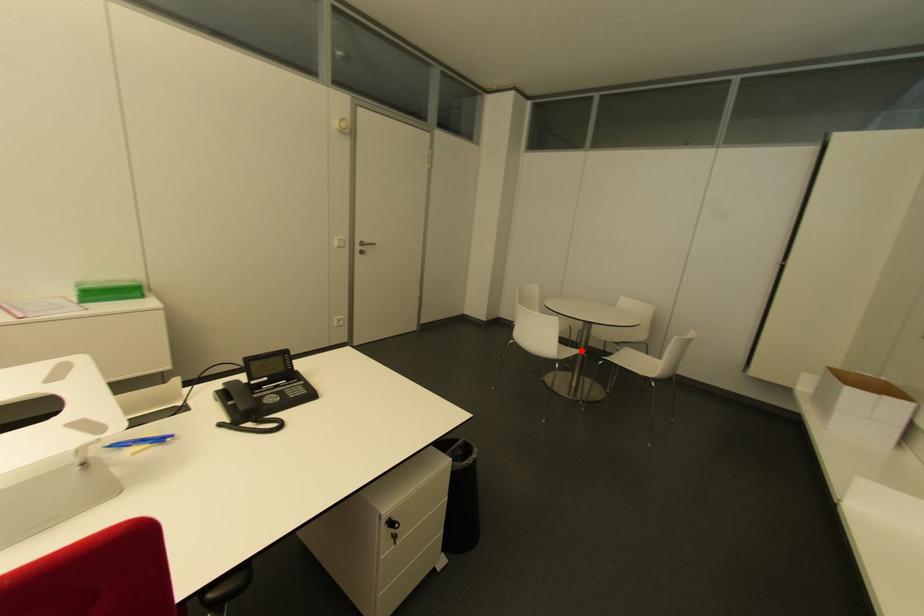
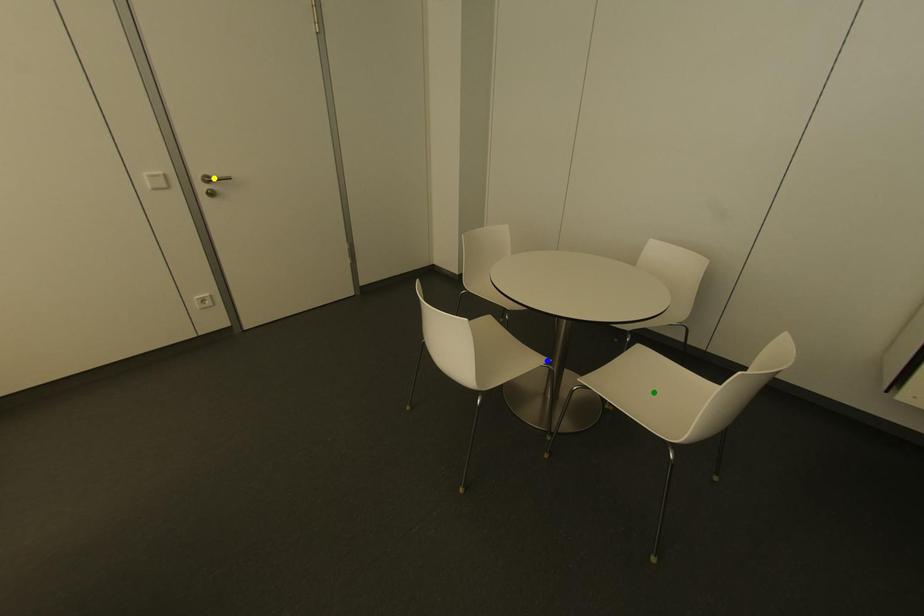
Question: I am providing you with two images of the same scene from different viewpoints. A red point is marked on the first image. You are given multiple points on the second image. Can you choose the point in image 2 that corresponds to the point in image 1?

Choices:
 (A) yellow point
 (B) green point
 (C) blue point

Answer: (C)